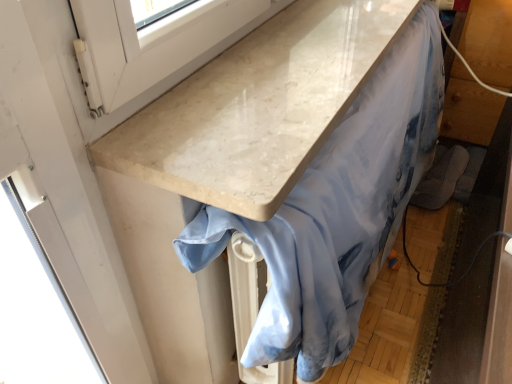
Question: Is light blue satin fabric at center inside or outside of white marble countertop at upper center?

Choices:
 (A) inside
 (B) outside

Answer: (B)

Question: Is light blue satin fabric at center taller or shorter than white marble countertop at upper center?

Choices:
 (A) short
 (B) tall

Answer: (B)

Question: Is light blue satin fabric at center bigger or smaller than white marble countertop at upper center?

Choices:
 (A) big
 (B) small

Answer: (A)

Question: Looking at the image, does white marble countertop at upper center seem bigger or smaller compared to light blue satin fabric at center?

Choices:
 (A) big
 (B) small

Answer: (B)

Question: Considering the positions of point (158, 130) and point (410, 87), is point (158, 130) closer or farther from the camera than point (410, 87)?

Choices:
 (A) farther
 (B) closer

Answer: (B)

Question: Choose the correct answer: Is white marble countertop at upper center inside light blue satin fabric at center or outside it?

Choices:
 (A) outside
 (B) inside

Answer: (A)

Question: From the image's perspective, is white marble countertop at upper center positioned above or below light blue satin fabric at center?

Choices:
 (A) above
 (B) below

Answer: (A)